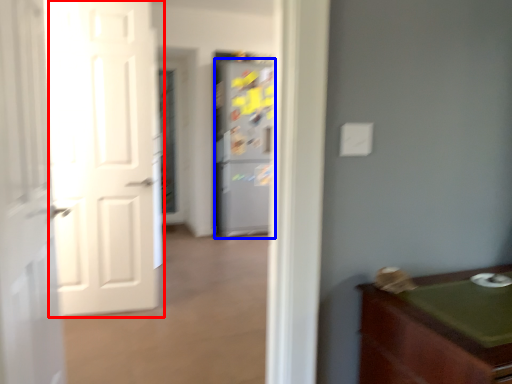
Question: Which object is closer to the camera taking this photo, door (highlighted by a red box) or refrigerator (highlighted by a blue box)?

Choices:
 (A) door
 (B) refrigerator

Answer: (A)